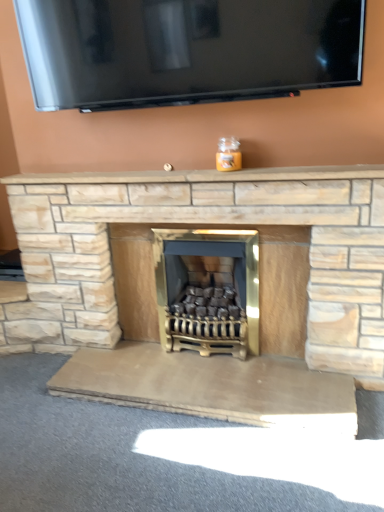
Question: In terms of size, does beige stone mantle at center appear bigger or smaller than natural stone fireplace at center?

Choices:
 (A) big
 (B) small

Answer: (B)

Question: In terms of width, does beige stone mantle at center look wider or thinner when compared to natural stone fireplace at center?

Choices:
 (A) thin
 (B) wide

Answer: (A)

Question: Which of these objects is positioned farthest from the beige stone mantle at center?

Choices:
 (A) natural stone fireplace at center
 (B) gold metallic wood burning stove at center

Answer: (B)

Question: Based on their relative distances, which object is nearer to the gold metallic wood burning stove at center?

Choices:
 (A) beige stone mantle at center
 (B) natural stone fireplace at center

Answer: (B)